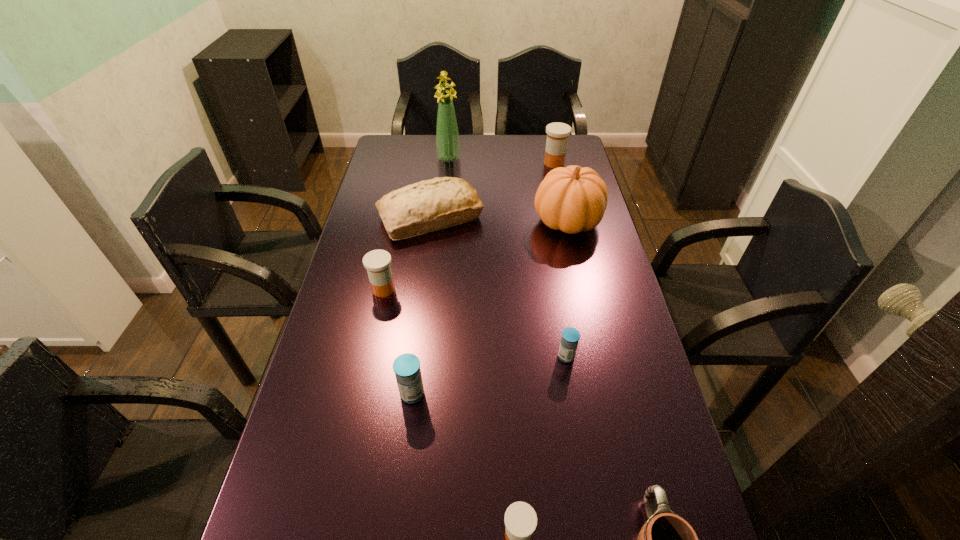
You are a GUI agent. You are given a task and a screenshot of the screen. Output one action in this format:
    pyautogui.click(x=<x>, y=<y>)
    Task: Click on the free space at the left edge of the desktop
    
    Given the screenshot: What is the action you would take?
    pyautogui.click(x=314, y=433)

The width and height of the screenshot is (960, 540). I want to click on free space at the right edge of the desktop, so click(x=643, y=448).

Identify the location of vacant region between the left blue medicine and the bread. The height and width of the screenshot is (540, 960). (421, 305).

The width and height of the screenshot is (960, 540). I want to click on unoccupied position between the bread and the farther blue medicine, so click(x=498, y=287).

This screenshot has height=540, width=960. I want to click on free space that is in between the left blue medicine and the farthest medicine, so click(483, 279).

Find the location of a particular element. This screenshot has height=540, width=960. free spot between the second tallest object and the bread is located at coordinates (499, 219).

In order to click on empty location between the bread and the pumpkin in this screenshot , I will do `click(499, 219)`.

Find the location of a particular element. The image size is (960, 540). vacant region between the biggest orange medicine and the bigger blue medicine is located at coordinates (483, 279).

You are a GUI agent. You are given a task and a screenshot of the screen. Output one action in this format:
    pyautogui.click(x=<x>, y=<y>)
    Task: Click on the object that is the second closest one to the biggest orange medicine
    The image size is (960, 540).
    Given the screenshot: What is the action you would take?
    pyautogui.click(x=429, y=205)

The height and width of the screenshot is (540, 960). Find the location of `the closest object to the bread`. the closest object to the bread is located at coordinates (377, 262).